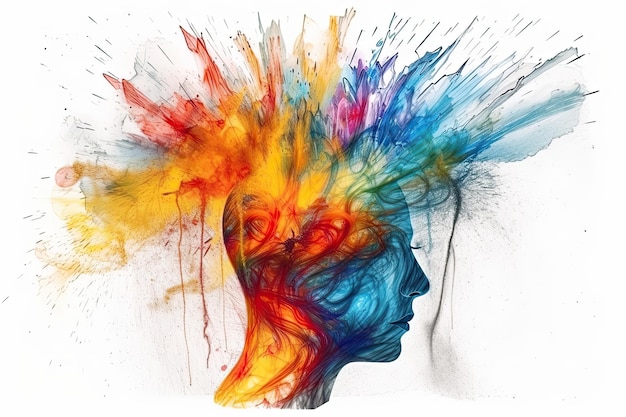
Identify the location of red paint. This screenshot has height=417, width=626. (230, 177), (262, 233), (321, 238), (274, 321), (253, 327), (307, 377), (265, 108), (235, 167), (216, 74), (205, 333).